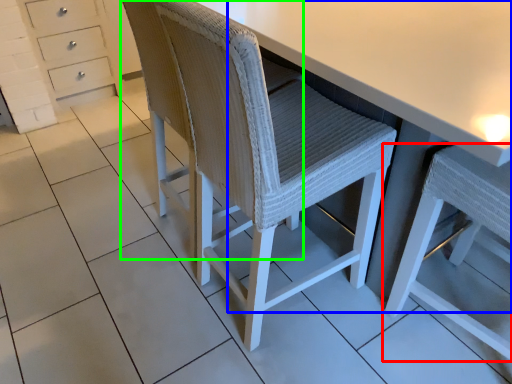
Question: Estimate the real-world distances between objects in this image. Which object is closer to chair (highlighted by a red box), table (highlighted by a blue box) or swivel chair (highlighted by a green box)?

Choices:
 (A) table
 (B) swivel chair

Answer: (A)